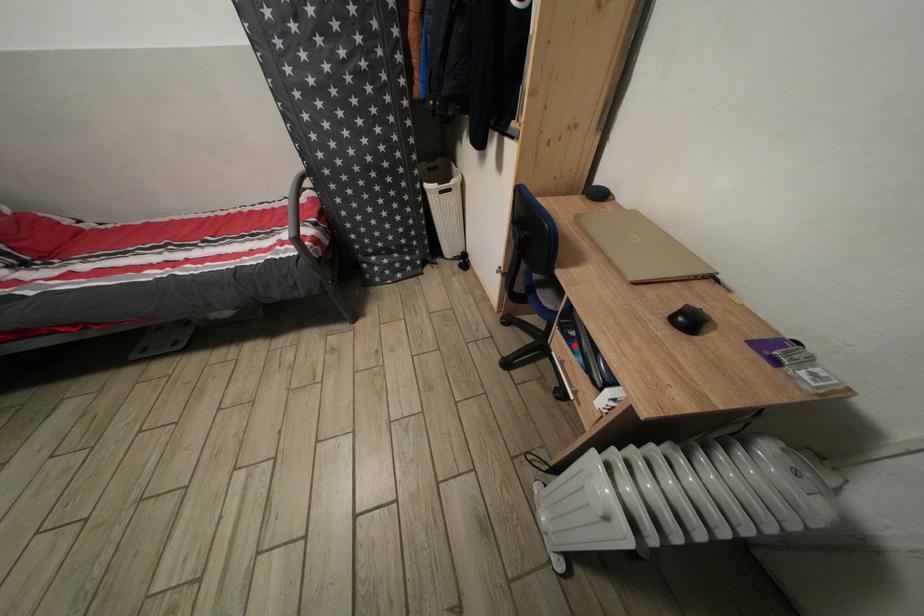
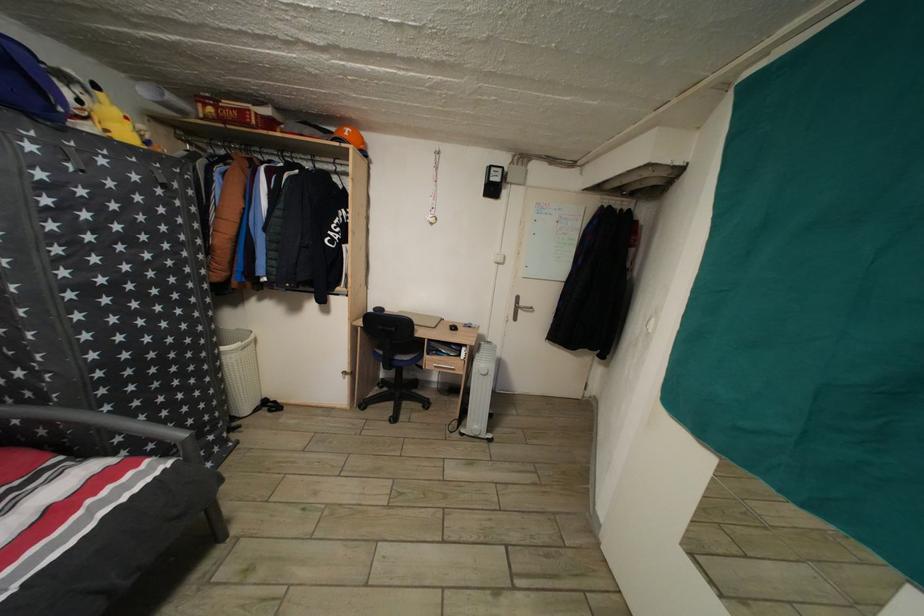
Find the pixel in the second image that matches the highlighted location in the first image.

(443, 361)